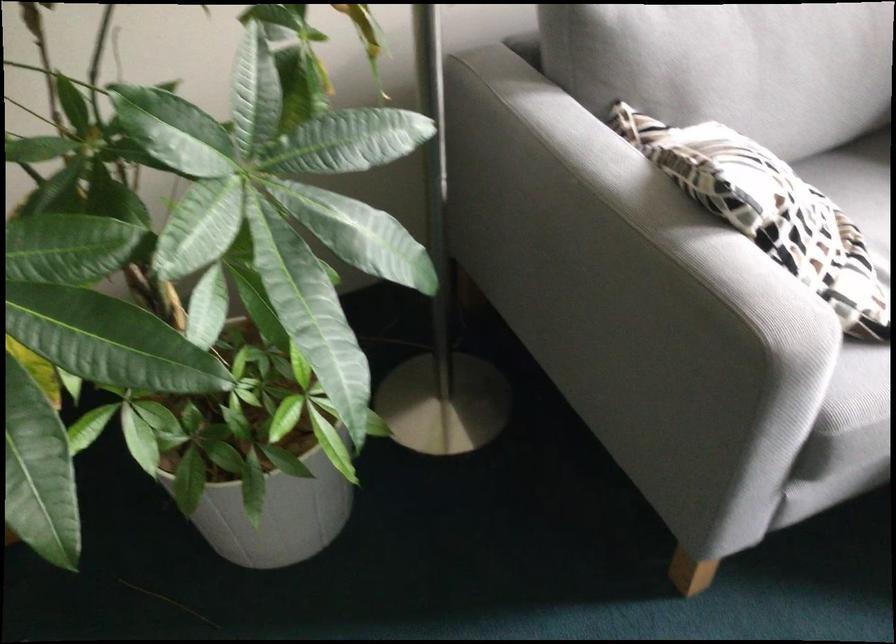
Image resolution: width=896 pixels, height=644 pixels. What do you see at coordinates (604, 240) in the screenshot? I see `a sofa armrest` at bounding box center [604, 240].